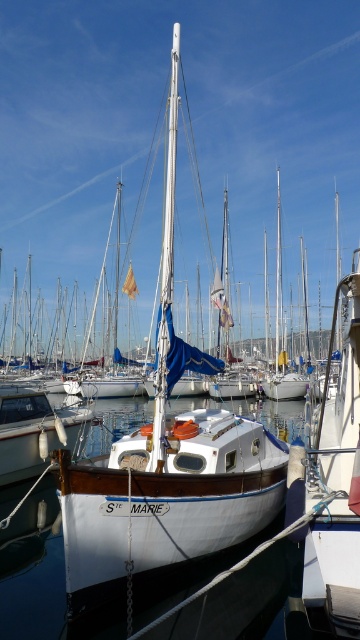
Question: Is white wood sailboat at center to the left of white matte sailboat at center from the viewer's perspective?

Choices:
 (A) yes
 (B) no

Answer: (A)

Question: Is white wood sailboat at center thinner than white matte sailboat at center?

Choices:
 (A) yes
 (B) no

Answer: (A)

Question: Is white wood sailboat at center to the right of white matte sailboat at center from the viewer's perspective?

Choices:
 (A) yes
 (B) no

Answer: (B)

Question: Which of the following is the closest to the observer?

Choices:
 (A) (72, 483)
 (B) (321, 436)

Answer: (A)

Question: Which object appears closest to the camera in this image?

Choices:
 (A) white matte sailboat at center
 (B) white wood sailboat at center

Answer: (A)